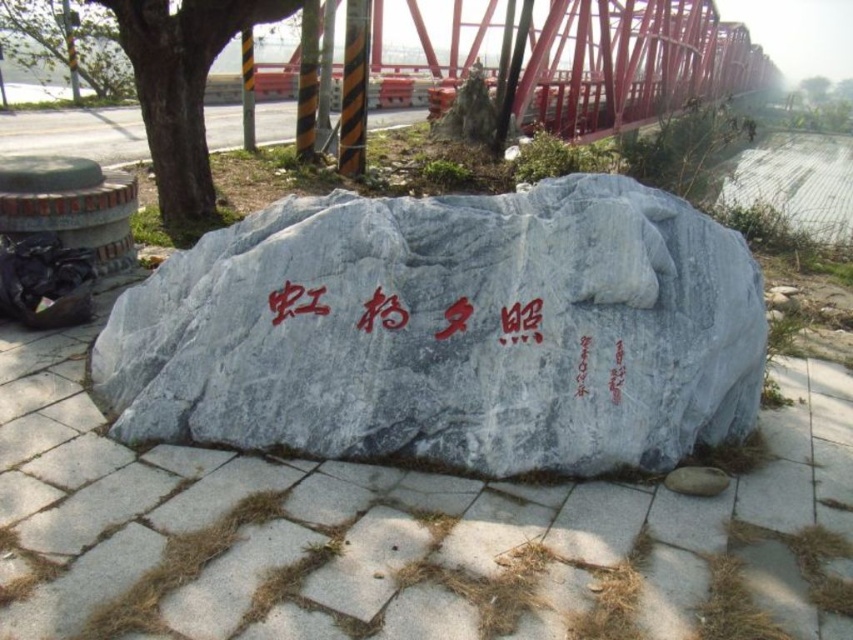
You are a landscape architect designing a new park layout. You need to place a new bench that must be closer to the gray polished stone boulder at center than to the green leafy tree at left. Given their sizes, which object should the bench be positioned nearer to?

The bench should be positioned nearer to the gray polished stone boulder at center since it is smaller in size compared to the green leafy tree at left, allowing for better spatial arrangement.

You are a landscape architect designing a new park layout. You need to place a new bench such that it is closer to the gray polished stone boulder at center than to the green leafy tree at left. Based on the scene, can you confirm if this is feasible?

The gray polished stone boulder at center has a lesser height compared to the green leafy tree at left, but this information does not provide details about their distances. Therefore, it is unclear if placing the bench closer to the boulder is feasible based solely on the given information.

From the picture: You are a tourist visiting the park and want to take a photo of the gray stone pavement at center and the red stone writing at center. If you stand to the right of the rock, which object will be on your left in the photo?

The gray stone pavement at center will be on your left in the photo because it is positioned on the left side of the red stone writing at center, so when standing to the right of the rock, the gray stone pavement at center comes first from the left side.